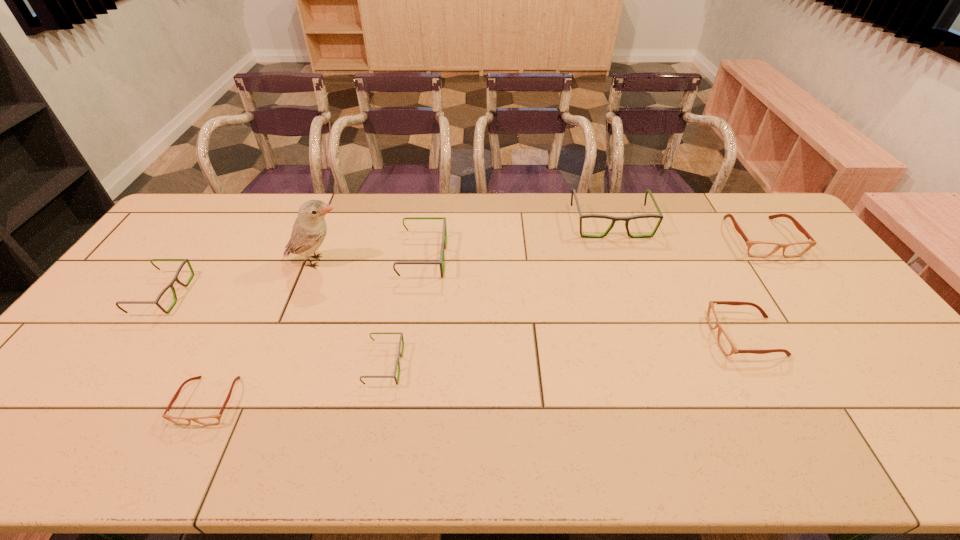
This screenshot has width=960, height=540. What are the coordinates of `blank space located 0.090m on the front-facing side of the second object from right to left` in the screenshot? It's located at (679, 336).

Where is `free region located on the front-facing side of the second object from right to left`? free region located on the front-facing side of the second object from right to left is located at coordinates (623, 336).

Locate an element on the screen. The width and height of the screenshot is (960, 540). free space located 0.350m on the lens of the smallest black spectacles is located at coordinates (539, 364).

Locate an element on the screen. vacant region located on the front-facing side of the shortest object is located at coordinates (181, 458).

Locate an element on the screen. The height and width of the screenshot is (540, 960). object that is at the near edge is located at coordinates (213, 419).

Locate an element on the screen. The width and height of the screenshot is (960, 540). object that is at the left edge is located at coordinates (175, 278).

The height and width of the screenshot is (540, 960). In order to click on object at the right edge in this screenshot , I will do `click(758, 249)`.

This screenshot has height=540, width=960. Find the location of `object that is at the far right corner`. object that is at the far right corner is located at coordinates (758, 249).

Where is `free spot at the far edge of the desktop`? free spot at the far edge of the desktop is located at coordinates (624, 227).

Where is `vacant space at the near edge`? The width and height of the screenshot is (960, 540). vacant space at the near edge is located at coordinates (769, 436).